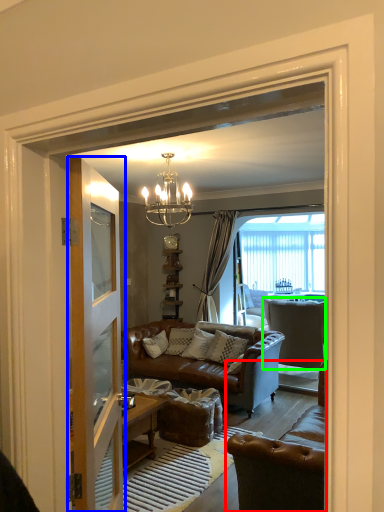
Question: Which object is the closest to the chair (highlighted by a red box)? Choose among these: door (highlighted by a blue box) or chair (highlighted by a green box).

Choices:
 (A) door
 (B) chair

Answer: (A)